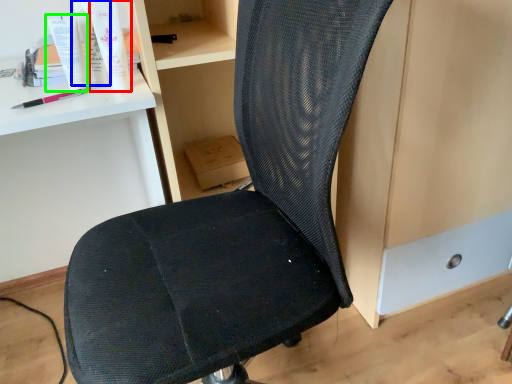
Question: Which object is the farthest from toiletry (highlighted by a red box)? Choose among these: toiletry (highlighted by a blue box) or toothpaste (highlighted by a green box).

Choices:
 (A) toiletry
 (B) toothpaste

Answer: (B)